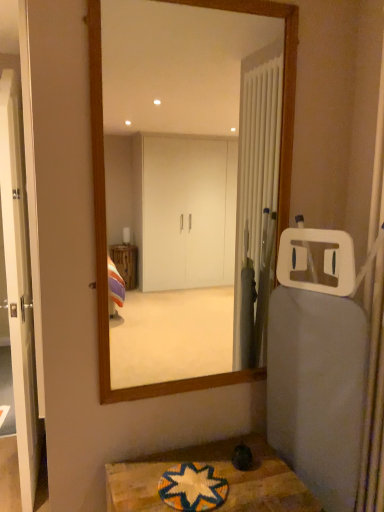
Question: Does wooden framed mirror at center come behind white glossy door at left?

Choices:
 (A) no
 (B) yes

Answer: (A)

Question: Does wooden framed mirror at center contain white glossy door at left?

Choices:
 (A) yes
 (B) no

Answer: (B)

Question: From a real-world perspective, is wooden framed mirror at center on white glossy door at left?

Choices:
 (A) no
 (B) yes

Answer: (B)

Question: From the image's perspective, is wooden framed mirror at center on white glossy door at left?

Choices:
 (A) yes
 (B) no

Answer: (A)

Question: Can you confirm if wooden framed mirror at center is taller than white glossy door at left?

Choices:
 (A) yes
 (B) no

Answer: (B)

Question: Considering their positions, is multicolored woven mat at lower center located in front of or behind white glossy door at left?

Choices:
 (A) behind
 (B) front

Answer: (B)

Question: From a real-world perspective, is multicolored woven mat at lower center above or below white glossy door at left?

Choices:
 (A) above
 (B) below

Answer: (B)

Question: Based on their sizes in the image, would you say multicolored woven mat at lower center is bigger or smaller than white glossy door at left?

Choices:
 (A) big
 (B) small

Answer: (B)

Question: In terms of height, does multicolored woven mat at lower center look taller or shorter compared to white glossy door at left?

Choices:
 (A) short
 (B) tall

Answer: (A)

Question: Based on their sizes in the image, would you say wooden textured table at lower center is bigger or smaller than multicolored woven mat at lower center?

Choices:
 (A) big
 (B) small

Answer: (A)

Question: Considering their positions, is wooden textured table at lower center located in front of or behind multicolored woven mat at lower center?

Choices:
 (A) behind
 (B) front

Answer: (B)

Question: Based on their positions, is wooden textured table at lower center located to the left or right of multicolored woven mat at lower center?

Choices:
 (A) left
 (B) right

Answer: (B)

Question: Looking at their shapes, would you say wooden textured table at lower center is wider or thinner than multicolored woven mat at lower center?

Choices:
 (A) wide
 (B) thin

Answer: (A)

Question: Is multicolored woven mat at lower center taller or shorter than wooden textured table at lower center?

Choices:
 (A) short
 (B) tall

Answer: (A)

Question: From a real-world perspective, is multicolored woven mat at lower center physically located above or below wooden textured table at lower center?

Choices:
 (A) above
 (B) below

Answer: (A)